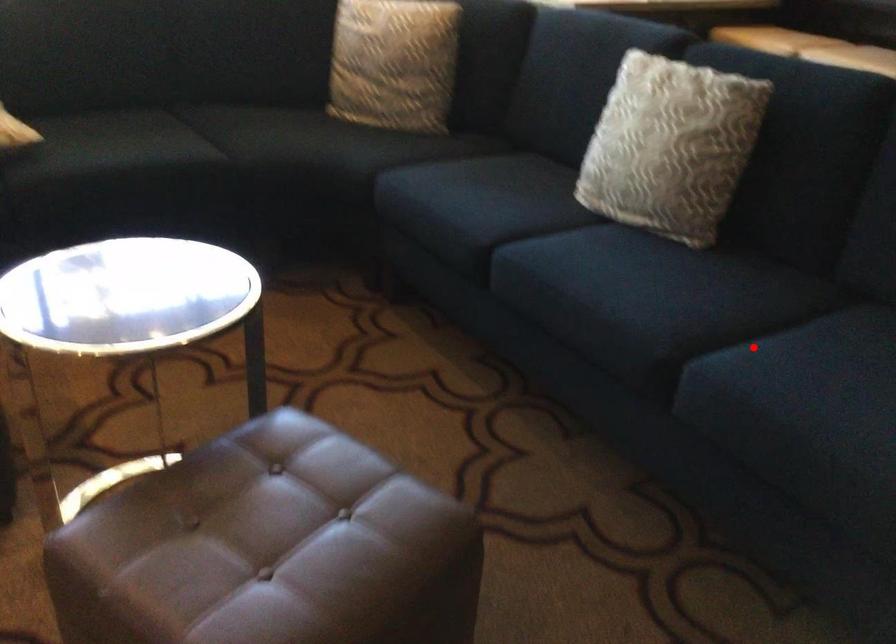
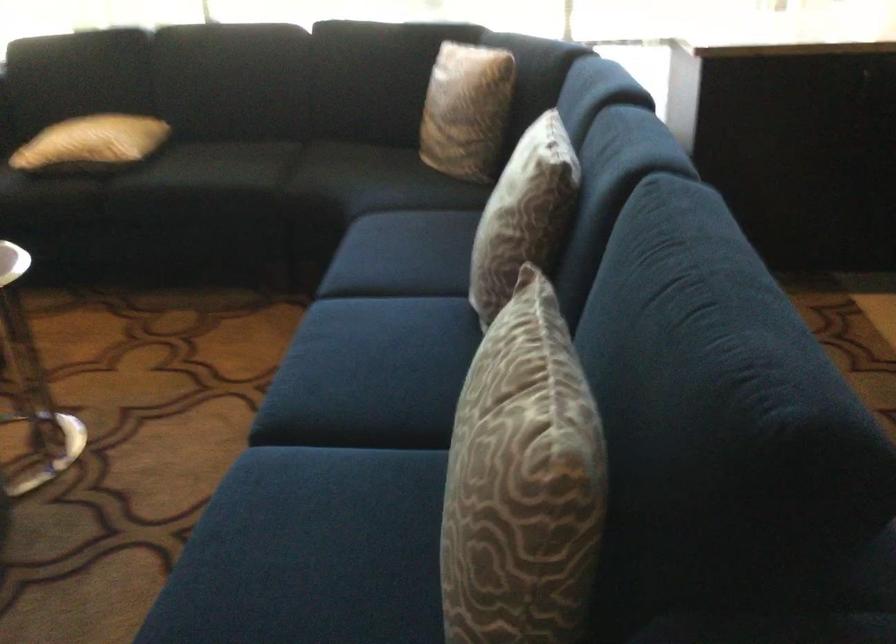
Question: A red point is marked in image1. In image2, is the corresponding 3D point closer to the camera or farther? Reply with the corresponding letter.

Choices:
 (A) The corresponding 3D point is closer.
 (B) The corresponding 3D point is farther.

Answer: (A)